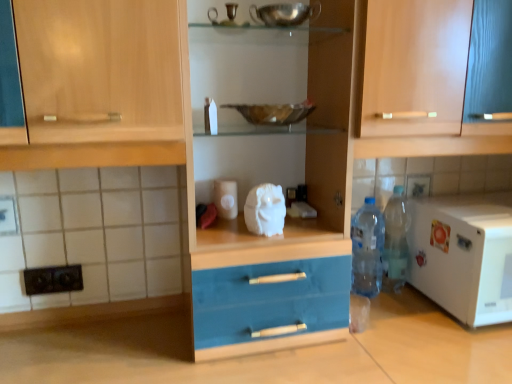
Measure the distance between metallic reflective bowl at center and camera.

They are 3.33 feet apart.

Locate an element on the screen. This screenshot has width=512, height=384. metallic reflective bowl at center is located at coordinates (273, 113).

Locate an element on the screen. translucent plastic bottle at lower right, the 2th bottle viewed from the left is located at coordinates (395, 242).

Describe the element at coordinates (395, 242) in the screenshot. I see `translucent plastic bottle at lower right, which is counted as the first bottle, starting from the right` at that location.

Describe the element at coordinates (420, 89) in the screenshot. The image size is (512, 384). I see `wooden cabinet at upper center` at that location.

The image size is (512, 384). What do you see at coordinates (418, 186) in the screenshot? I see `white glossy tile at upper center` at bounding box center [418, 186].

Measure the distance between white matte microwave at right and camera.

white matte microwave at right is 1.07 meters away from camera.

Identify the location of translucent plastic bottle at lower right, the first bottle from the left. Image resolution: width=512 pixels, height=384 pixels. (367, 249).

From the image's perspective, does translucent plastic bottle at lower right, the first bottle from the left, appear lower than translucent plastic bottle at lower right, which is counted as the first bottle, starting from the right?

Yes.

Looking at this image, considering the relative sizes of translucent plastic bottle at lower right, the first bottle from the left, and translucent plastic bottle at lower right, the 2th bottle viewed from the left, in the image provided, is translucent plastic bottle at lower right, the first bottle from the left, shorter than translucent plastic bottle at lower right, the 2th bottle viewed from the left,?

Yes.

How different are the orientations of translucent plastic bottle at lower right, the first bottle from the left, and translucent plastic bottle at lower right, the 2th bottle viewed from the left, in degrees?

translucent plastic bottle at lower right, the first bottle from the left, and translucent plastic bottle at lower right, the 2th bottle viewed from the left, are facing 6.97e-05 degrees away from each other.

I want to click on bottle on the right of translucent plastic bottle at lower right, the first bottle from the left, so click(395, 242).

Based on their sizes in the image, would you say wooden cabinet at upper center is bigger or smaller than white matte microwave at right?

wooden cabinet at upper center is bigger than white matte microwave at right.

Which is farther, [503,127] or [489,207]?

The point [489,207] is behind.

Between wooden cabinet at upper center and white matte microwave at right, which one has more height?

wooden cabinet at upper center.

Is wooden cabinet at upper center positioned beyond the bounds of white matte microwave at right?

Yes.

From a real-world perspective, which object rests below the other?

In real-world perspective, matte wood cabinet at center is lower.

Is metallic reflective bowl at center facing away from matte wood cabinet at center?

That's right, metallic reflective bowl at center is facing away from matte wood cabinet at center.

Considering the sizes of metallic reflective bowl at center and matte wood cabinet at center in the image, is metallic reflective bowl at center wider or thinner than matte wood cabinet at center?

Clearly, metallic reflective bowl at center has less width compared to matte wood cabinet at center.

Between metallic reflective bowl at center and matte wood cabinet at center, which one has less height?

Standing shorter between the two is metallic reflective bowl at center.

Is white matte microwave at right further to the viewer compared to translucent plastic bottle at lower right, arranged as the 2th bottle when viewed from the right?

That is False.

Which is correct: white matte microwave at right is inside translucent plastic bottle at lower right, the first bottle from the left, or outside of it?

white matte microwave at right cannot be found inside translucent plastic bottle at lower right, the first bottle from the left.

Does white matte microwave at right have a smaller size compared to translucent plastic bottle at lower right, the first bottle from the left?

No.

Which is more to the left, white matte microwave at right or translucent plastic bottle at lower right, the first bottle from the left?

Positioned to the left is translucent plastic bottle at lower right, the first bottle from the left.

Does metallic reflective bowl at center lie in front of translucent plastic bottle at lower right, the 2th bottle viewed from the left?

Yes, it is.

Choose the correct answer: Is metallic reflective bowl at center inside translucent plastic bottle at lower right, which is counted as the first bottle, starting from the right, or outside it?

metallic reflective bowl at center is not enclosed by translucent plastic bottle at lower right, which is counted as the first bottle, starting from the right.

Is metallic reflective bowl at center looking in the opposite direction of translucent plastic bottle at lower right, which is counted as the first bottle, starting from the right?

metallic reflective bowl at center does not have its back to translucent plastic bottle at lower right, which is counted as the first bottle, starting from the right.

Choose the correct answer: Is white glossy tile at upper center inside wooden cabinet at upper center or outside it?

white glossy tile at upper center is located beyond the bounds of wooden cabinet at upper center.

Image resolution: width=512 pixels, height=384 pixels. What are the coordinates of `tile that appears behind the wooden cabinet at upper center` in the screenshot? It's located at (418, 186).

In the scene shown: Considering the positions of objects white glossy tile at upper center and wooden cabinet at upper center in the image provided, who is more to the right, white glossy tile at upper center or wooden cabinet at upper center?

From the viewer's perspective, white glossy tile at upper center appears more on the right side.

Which is less distant, (425,178) or (458,107)?

The point (458,107) is closer to the camera.

Looking at this image, is wooden cabinet at upper center thinner than translucent plastic bottle at lower right, the first bottle from the left?

No.

Is wooden cabinet at upper center aimed at translucent plastic bottle at lower right, arranged as the 2th bottle when viewed from the right?

No, wooden cabinet at upper center does not turn towards translucent plastic bottle at lower right, arranged as the 2th bottle when viewed from the right.

Find the location of a particular element. This screenshot has height=384, width=512. cabinetry above the translucent plastic bottle at lower right, arranged as the 2th bottle when viewed from the right (from the image's perspective) is located at coordinates (420, 89).

Where is `bottle that appears on the left of translucent plastic bottle at lower right, the 2th bottle viewed from the left`? The height and width of the screenshot is (384, 512). bottle that appears on the left of translucent plastic bottle at lower right, the 2th bottle viewed from the left is located at coordinates coord(367,249).

Image resolution: width=512 pixels, height=384 pixels. In order to click on cabinetry located in front of the white matte microwave at right in this screenshot , I will do `click(420, 89)`.

Based on their spatial positions, is white glossy tile at upper center or white matte microwave at right further from translucent plastic bottle at lower right, which is counted as the first bottle, starting from the right?

The object further to translucent plastic bottle at lower right, which is counted as the first bottle, starting from the right, is white matte microwave at right.

From the image, which object appears to be nearer to translucent plastic bottle at lower right, the first bottle from the left, white matte microwave at right or white glossy tile at upper center?

white glossy tile at upper center.

When comparing their distances from white glossy tile at upper center, does translucent plastic bottle at lower right, arranged as the 2th bottle when viewed from the right, or matte wood cabinet at center seem closer?

The object closer to white glossy tile at upper center is translucent plastic bottle at lower right, arranged as the 2th bottle when viewed from the right.

When comparing their distances from wooden cabinet at upper center, does metallic reflective bowl at center or matte wood cabinet at center seem further?

metallic reflective bowl at center lies further to wooden cabinet at upper center than the other object.

Which object lies nearer to the anchor point wooden cabinet at upper center, white glossy tile at upper center or translucent plastic bottle at lower right, the 2th bottle viewed from the left?

Among the two, white glossy tile at upper center is located nearer to wooden cabinet at upper center.

From the image, which object appears to be farther from wooden cabinet at upper center, metallic reflective bowl at center or white glossy tile at upper center?

white glossy tile at upper center.

In the scene shown: From the image, which object appears to be farther from translucent plastic bottle at lower right, which is counted as the first bottle, starting from the right, metallic reflective bowl at center or wooden cabinet at upper center?

Among the two, metallic reflective bowl at center is located further to translucent plastic bottle at lower right, which is counted as the first bottle, starting from the right.

From the image, which object appears to be nearer to metallic reflective bowl at center, white glossy tile at upper center or wooden cabinet at upper center?

The object closer to metallic reflective bowl at center is wooden cabinet at upper center.

Find the location of a particular element. The width and height of the screenshot is (512, 384). bowl positioned between matte wood cabinet at center and white glossy tile at upper center from near to far is located at coordinates (273, 113).

Where is `bowl between matte wood cabinet at center and translucent plastic bottle at lower right, the 2th bottle viewed from the left, from left to right`? The height and width of the screenshot is (384, 512). bowl between matte wood cabinet at center and translucent plastic bottle at lower right, the 2th bottle viewed from the left, from left to right is located at coordinates (273, 113).

The width and height of the screenshot is (512, 384). I want to click on bowl between matte wood cabinet at center and wooden cabinet at upper center in the horizontal direction, so click(x=273, y=113).

Where is `bottle between white glossy tile at upper center and translucent plastic bottle at lower right, the first bottle from the left, vertically`? This screenshot has width=512, height=384. bottle between white glossy tile at upper center and translucent plastic bottle at lower right, the first bottle from the left, vertically is located at coordinates (395, 242).